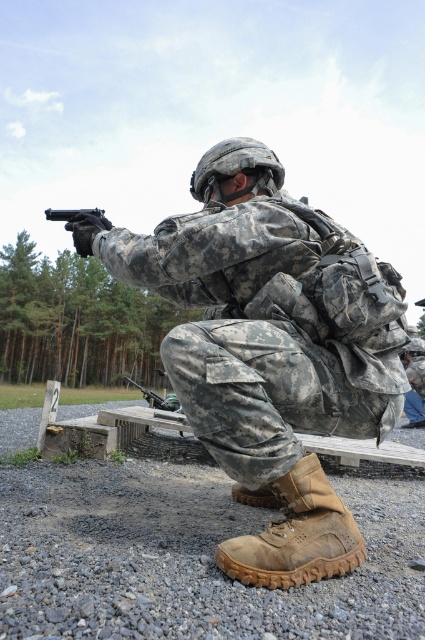
Question: Does camouflage fabric uniform at center appear on the right side of matte black shotgun at lower center?

Choices:
 (A) yes
 (B) no

Answer: (A)

Question: Considering the real-world distances, which object is closest to the brown rugged boot at lower center?

Choices:
 (A) matte black shotgun at lower center
 (B) camouflage fabric uniform at center
 (C) matte black handgun at upper center

Answer: (B)

Question: Is brown rugged boot at lower center wider than matte black shotgun at lower center?

Choices:
 (A) no
 (B) yes

Answer: (A)

Question: Which object is closer to the camera taking this photo?

Choices:
 (A) camouflage fabric uniform at center
 (B) matte black shotgun at lower center
 (C) matte black handgun at upper center
 (D) brown rugged boot at lower center

Answer: (D)

Question: Which of the following is the farthest from the observer?

Choices:
 (A) brown rugged boot at lower center
 (B) matte black shotgun at lower center

Answer: (B)

Question: Does matte black handgun at upper center come in front of matte black shotgun at lower center?

Choices:
 (A) yes
 (B) no

Answer: (A)